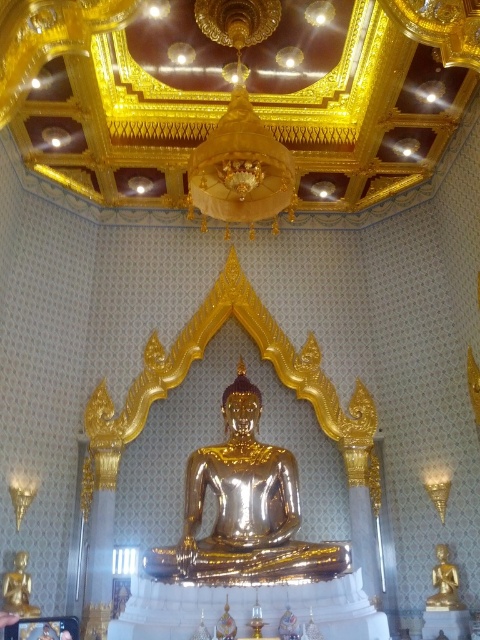
Question: Which point is closer to the camera?

Choices:
 (A) (12, 570)
 (B) (432, 582)

Answer: (A)

Question: Among these objects, which one is farthest from the camera?

Choices:
 (A) gold shiny statue at center
 (B) gold polished statue at lower left

Answer: (B)

Question: In this image, where is gold shiny statue at center located relative to gold shiny statue at lower right?

Choices:
 (A) above
 (B) below

Answer: (A)

Question: Does gold polished statue at lower left appear over gold shiny statue at lower right?

Choices:
 (A) no
 (B) yes

Answer: (B)

Question: Which object is the farthest from the gold shiny statue at lower right?

Choices:
 (A) gold shiny statue at center
 (B) gold polished statue at lower left

Answer: (B)

Question: Where is gold shiny statue at center located in relation to gold polished statue at lower left in the image?

Choices:
 (A) right
 (B) left

Answer: (A)